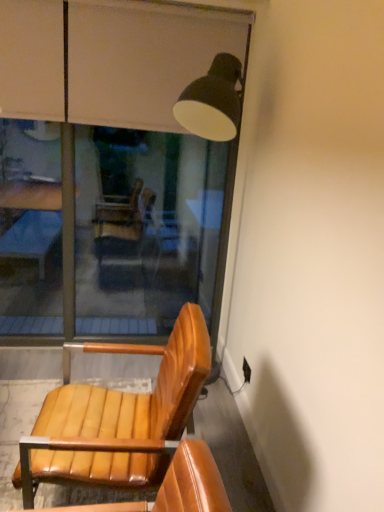
Question: Is transparent glass window at upper center wider or thinner than leather wood chair at lower left?

Choices:
 (A) thin
 (B) wide

Answer: (A)

Question: Is transparent glass window at upper center spatially inside leather wood chair at lower left, or outside of it?

Choices:
 (A) inside
 (B) outside

Answer: (B)

Question: From a real-world perspective, is transparent glass window at upper center above or below leather wood chair at lower left?

Choices:
 (A) below
 (B) above

Answer: (B)

Question: Is point (87, 439) closer or farther from the camera than point (13, 180)?

Choices:
 (A) farther
 (B) closer

Answer: (B)

Question: Is leather wood chair at lower left bigger or smaller than transparent glass window at upper center?

Choices:
 (A) small
 (B) big

Answer: (A)

Question: From the image's perspective, is leather wood chair at lower left above or below transparent glass window at upper center?

Choices:
 (A) below
 (B) above

Answer: (A)

Question: Considering the positions of leather wood chair at lower left and transparent glass window at upper center in the image, is leather wood chair at lower left wider or thinner than transparent glass window at upper center?

Choices:
 (A) thin
 (B) wide

Answer: (B)